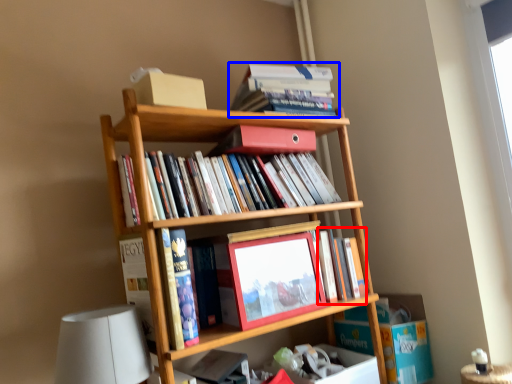
Question: Among these objects, which one is farthest to the camera, book (highlighted by a red box) or book (highlighted by a blue box)?

Choices:
 (A) book
 (B) book

Answer: (B)